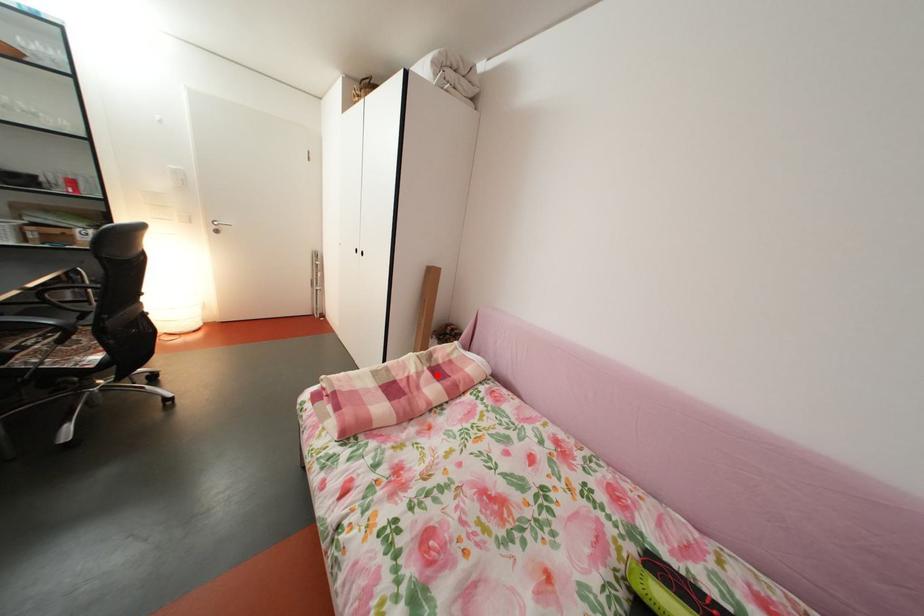
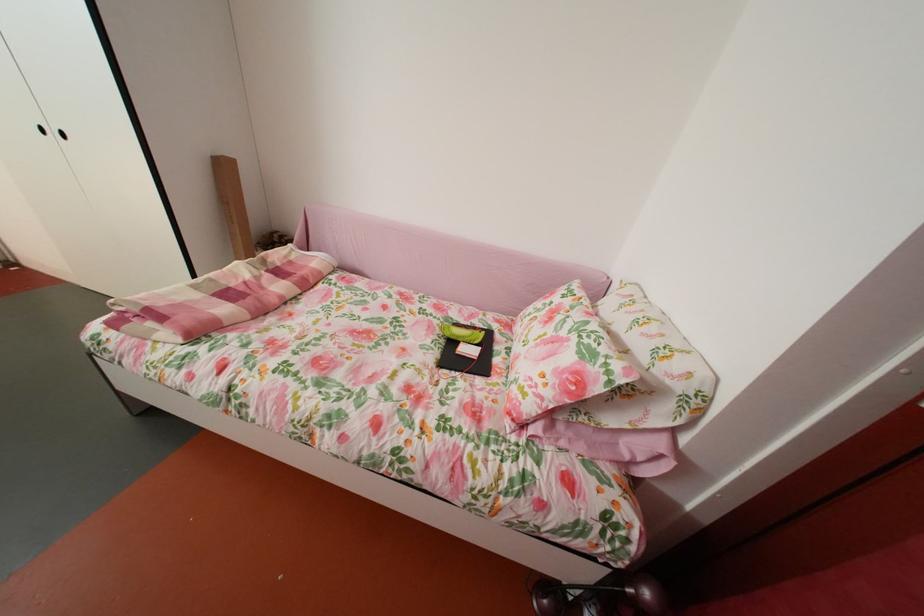
Question: I am providing you with two images of the same scene from different viewpoints. Given a red point in image1, look at the same physical point in image2. Is it:

Choices:
 (A) Closer to the viewpoint
 (B) Farther from the viewpoint

Answer: (A)